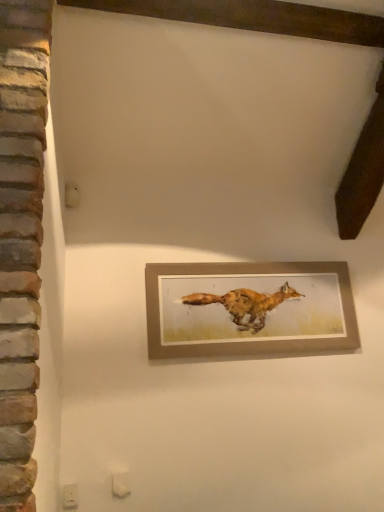
The width and height of the screenshot is (384, 512). What do you see at coordinates (249, 309) in the screenshot? I see `matte brown picture frame at center` at bounding box center [249, 309].

Identify the location of matte brown picture frame at center. (249, 309).

Where is `matte brown picture frame at center`? This screenshot has height=512, width=384. matte brown picture frame at center is located at coordinates (249, 309).